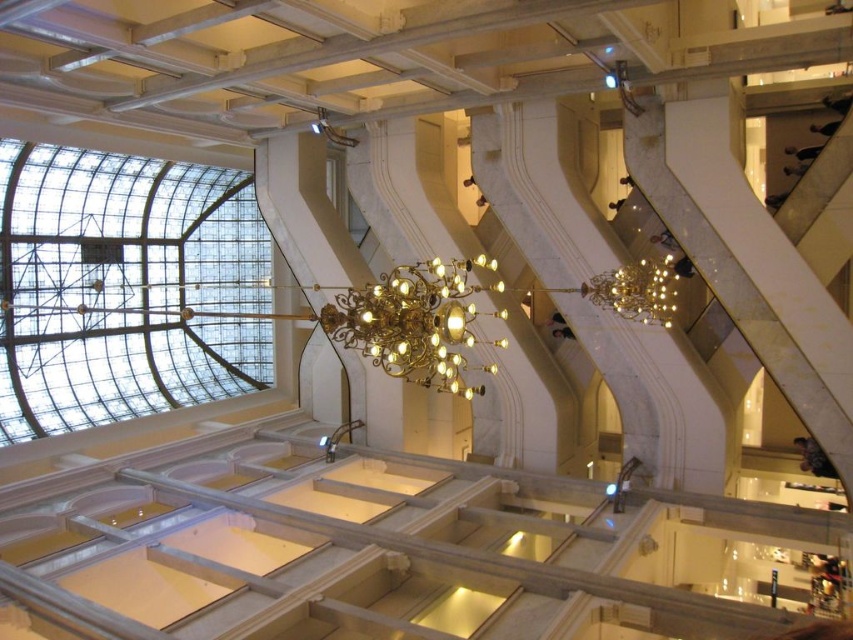
Can you confirm if transparent glass dome at upper center is smaller than gold metallic chandelier at upper center?

No.

Between transparent glass dome at upper center and gold metallic chandelier at upper center, which one is positioned lower?

gold metallic chandelier at upper center is below.

The image size is (853, 640). Describe the element at coordinates (125, 288) in the screenshot. I see `transparent glass dome at upper center` at that location.

Locate an element on the screen. This screenshot has height=640, width=853. transparent glass dome at upper center is located at coordinates (125, 288).

Can you confirm if gold metallic chandelier at center is wider than gold metallic chandelier at upper center?

Indeed, gold metallic chandelier at center has a greater width compared to gold metallic chandelier at upper center.

Describe the element at coordinates (415, 321) in the screenshot. The height and width of the screenshot is (640, 853). I see `gold metallic chandelier at center` at that location.

Identify the location of gold metallic chandelier at center. This screenshot has width=853, height=640. (415, 321).

Measure the distance between point (270, 298) and camera.

Point (270, 298) and camera are 201.36 feet apart from each other.

Who is more forward, (x=32, y=236) or (x=451, y=300)?

Point (x=451, y=300) is in front.

You are a GUI agent. You are given a task and a screenshot of the screen. Output one action in this format:
    pyautogui.click(x=<x>, y=<y>)
    Task: Click on the transparent glass dome at upper center
    Image resolution: width=853 pixels, height=640 pixels.
    Given the screenshot: What is the action you would take?
    pyautogui.click(x=125, y=288)